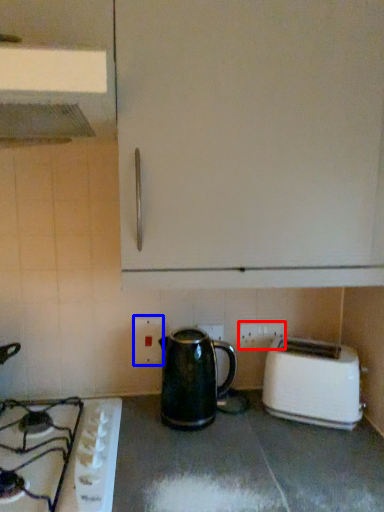
Question: Which of the following is the farthest to the observer, electric outlet (highlighted by a red box) or electric outlet (highlighted by a blue box)?

Choices:
 (A) electric outlet
 (B) electric outlet

Answer: (A)